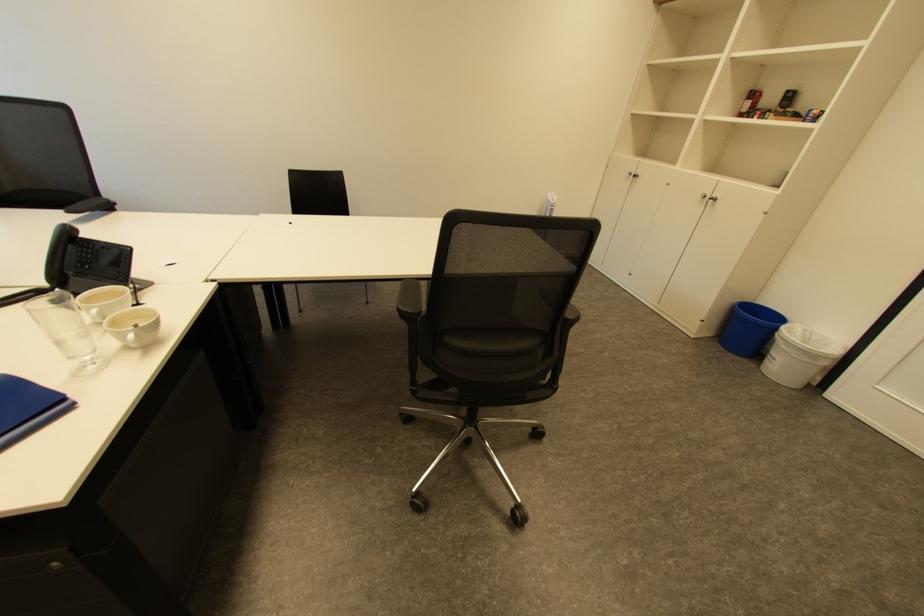
The location [798,355] corresponds to which object?

It corresponds to the white trash can in the image.